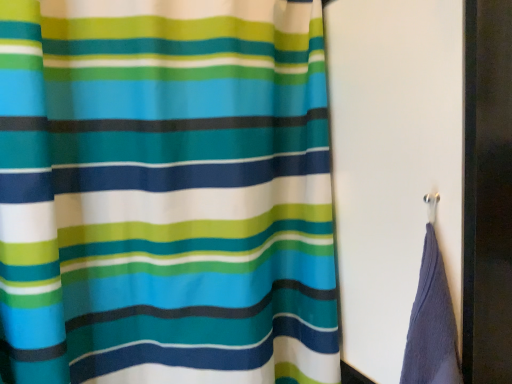
Question: Is matte fabric curtain at upper right oriented towards metallic hook at right?

Choices:
 (A) yes
 (B) no

Answer: (A)

Question: From a real-world perspective, is matte fabric curtain at upper right on metallic hook at right?

Choices:
 (A) yes
 (B) no

Answer: (B)

Question: Can you confirm if matte fabric curtain at upper right is bigger than metallic hook at right?

Choices:
 (A) yes
 (B) no

Answer: (A)

Question: Can you confirm if matte fabric curtain at upper right is shorter than metallic hook at right?

Choices:
 (A) yes
 (B) no

Answer: (B)

Question: Is metallic hook at right a part of matte fabric curtain at upper right?

Choices:
 (A) yes
 (B) no

Answer: (B)

Question: Can you confirm if matte fabric curtain at upper right is positioned to the right of metallic hook at right?

Choices:
 (A) yes
 (B) no

Answer: (B)

Question: Is metallic hook at right outside matte fabric curtain at upper right?

Choices:
 (A) no
 (B) yes

Answer: (B)

Question: Is metallic hook at right closer to camera compared to matte fabric curtain at upper right?

Choices:
 (A) yes
 (B) no

Answer: (B)

Question: Is metallic hook at right at the left side of matte fabric curtain at upper right?

Choices:
 (A) yes
 (B) no

Answer: (B)

Question: From a real-world perspective, is metallic hook at right located beneath matte fabric curtain at upper right?

Choices:
 (A) yes
 (B) no

Answer: (B)

Question: Is metallic hook at right oriented towards matte fabric curtain at upper right?

Choices:
 (A) yes
 (B) no

Answer: (A)

Question: Is metallic hook at right wider than matte fabric curtain at upper right?

Choices:
 (A) yes
 (B) no

Answer: (A)

Question: From their relative heights in the image, would you say metallic hook at right is taller or shorter than matte fabric curtain at upper right?

Choices:
 (A) short
 (B) tall

Answer: (A)